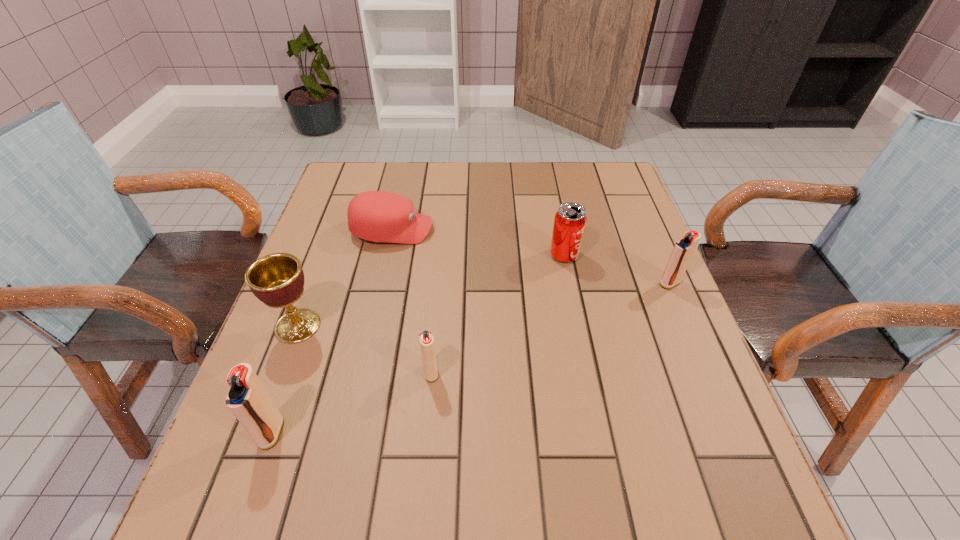
At what (x,y) coordinates should I click in order to perform the action: click on object at the near left corner. Please return your answer as a coordinate pair (x, y). The image size is (960, 540). Looking at the image, I should click on (248, 400).

Find the location of a particular element. This screenshot has height=540, width=960. free space at the far edge is located at coordinates (440, 186).

Identify the location of blank space at the near edge of the desktop. This screenshot has height=540, width=960. (497, 444).

In the image, there is a desktop. Where is `vacant region at the left edge`? vacant region at the left edge is located at coordinates (300, 307).

Find the location of a particular element. The height and width of the screenshot is (540, 960). vacant space at the right edge is located at coordinates click(593, 236).

At what (x,y) coordinates should I click in order to perform the action: click on vacant space at the far left corner of the desktop. Please return your answer as a coordinate pair (x, y). Image resolution: width=960 pixels, height=540 pixels. Looking at the image, I should click on [382, 186].

At what (x,y) coordinates should I click in order to perform the action: click on vacant space at the far right corner of the desktop. Please return your answer as a coordinate pair (x, y). This screenshot has width=960, height=540. Looking at the image, I should click on (624, 193).

Locate an element on the screen. Image resolution: width=960 pixels, height=540 pixels. free space between the second farthest igniter and the shortest object is located at coordinates (412, 301).

Locate an element on the screen. empty location between the nearest igniter and the third farthest object is located at coordinates (470, 357).

Where is `vacant area that lies between the fifth object from left to right and the fifth tallest object`? This screenshot has width=960, height=540. vacant area that lies between the fifth object from left to right and the fifth tallest object is located at coordinates (497, 314).